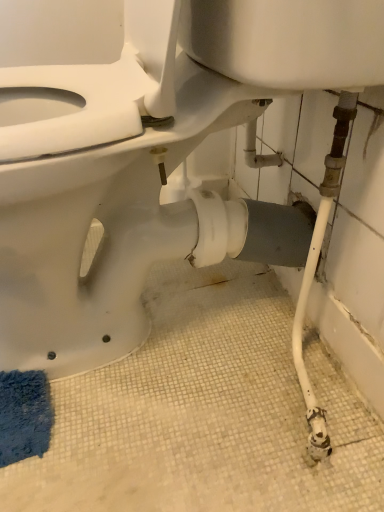
The width and height of the screenshot is (384, 512). What do you see at coordinates (143, 152) in the screenshot?
I see `white glossy toilet at center` at bounding box center [143, 152].

Locate an element on the screen. Image resolution: width=384 pixels, height=512 pixels. white glossy toilet at center is located at coordinates (143, 152).

Measure the distance between point (208, 67) and camera.

The distance of point (208, 67) from camera is 20.94 inches.

At what (x,y) coordinates should I click in order to perform the action: click on white glossy toilet at center. Please return your answer as a coordinate pair (x, y). The height and width of the screenshot is (512, 384). Looking at the image, I should click on (143, 152).